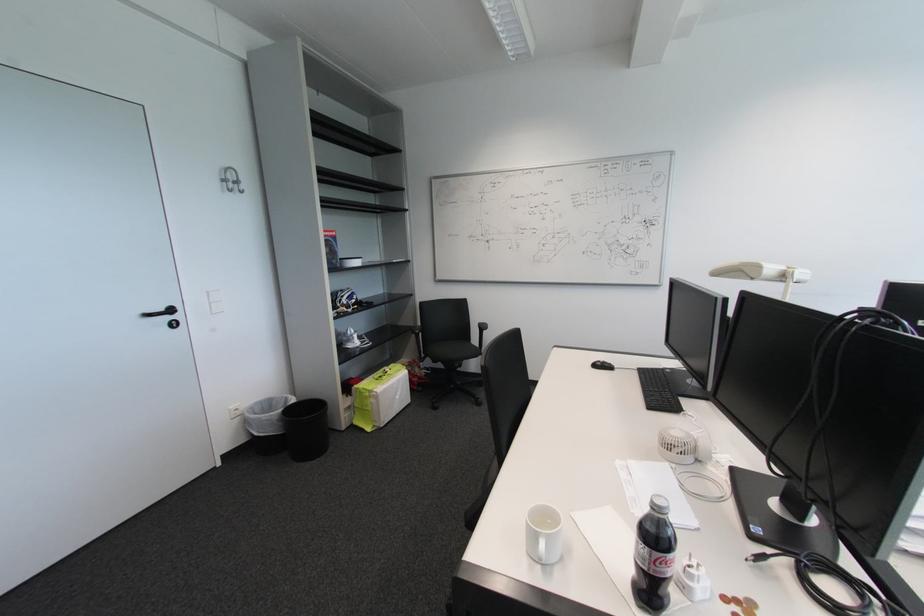
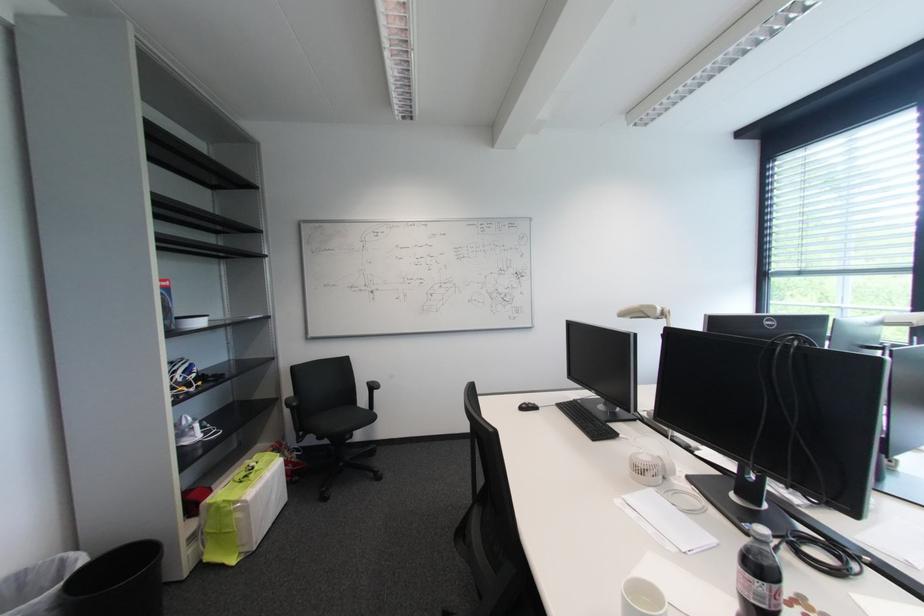
Where in the second image is the point corresponding to point 749,273 from the first image?

(649, 314)